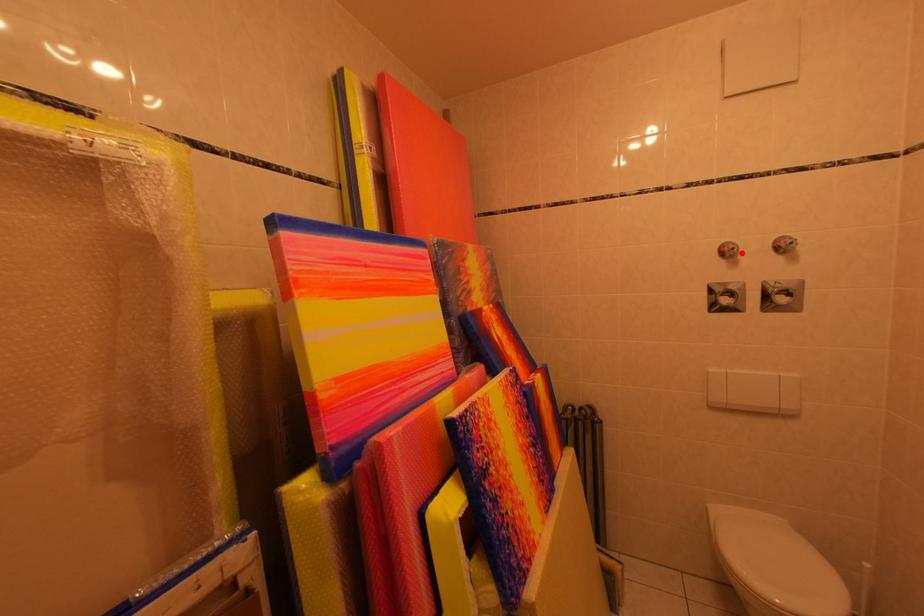
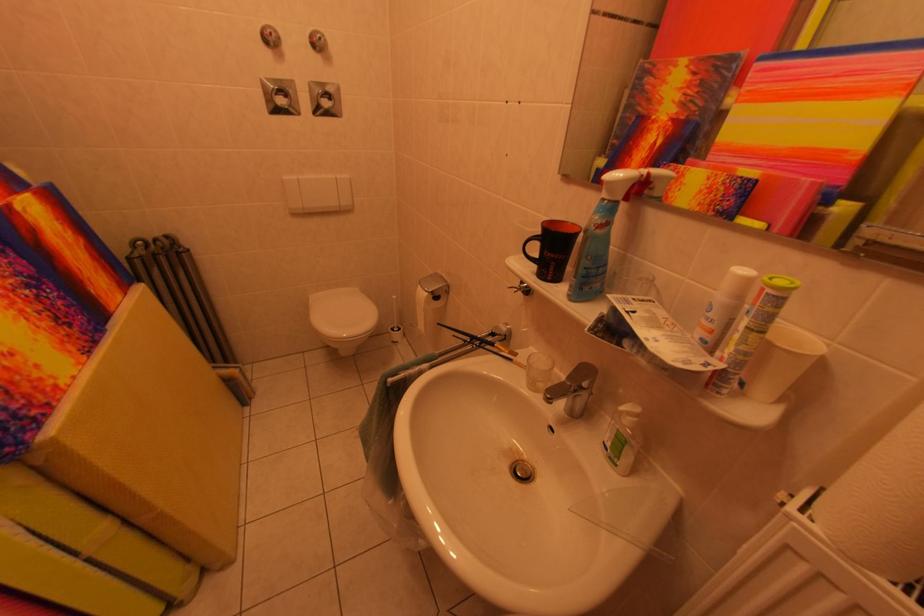
Where in the second image is the point corresponding to the highlighted location from the first image?

(278, 39)